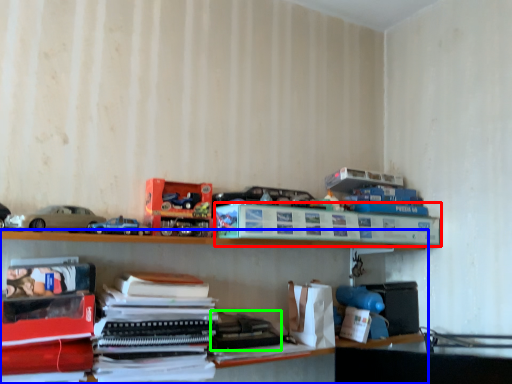
Question: Which object is positioned farthest from paperback book (highlighted by a red box)? Select from shelf (highlighted by a blue box) and book (highlighted by a green box).

Choices:
 (A) shelf
 (B) book

Answer: (B)